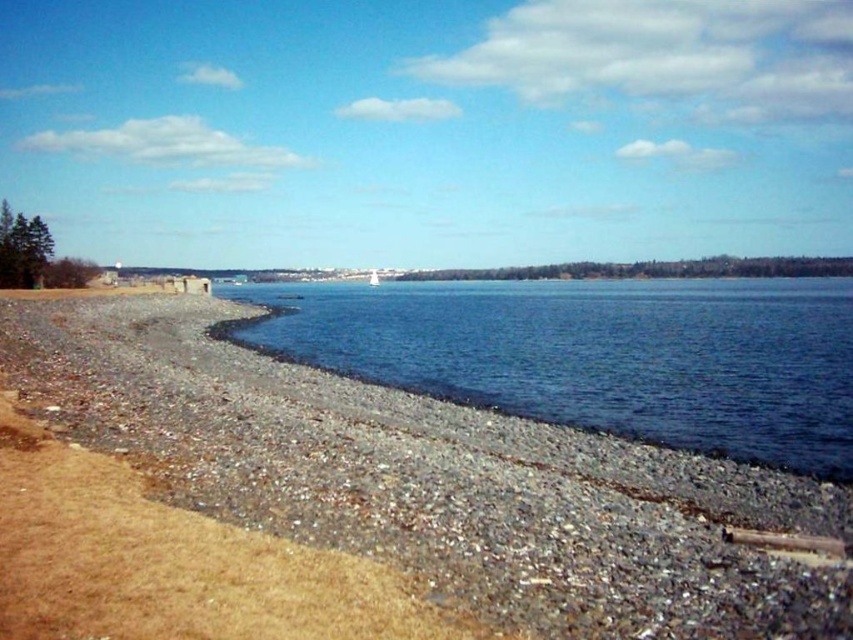
You are standing at the point labeled as point (x=432, y=480) in the image. What type of terrain are you currently standing on?

You are standing on a gravelly sand beach at lower left as indicated by the point (x=432, y=480).